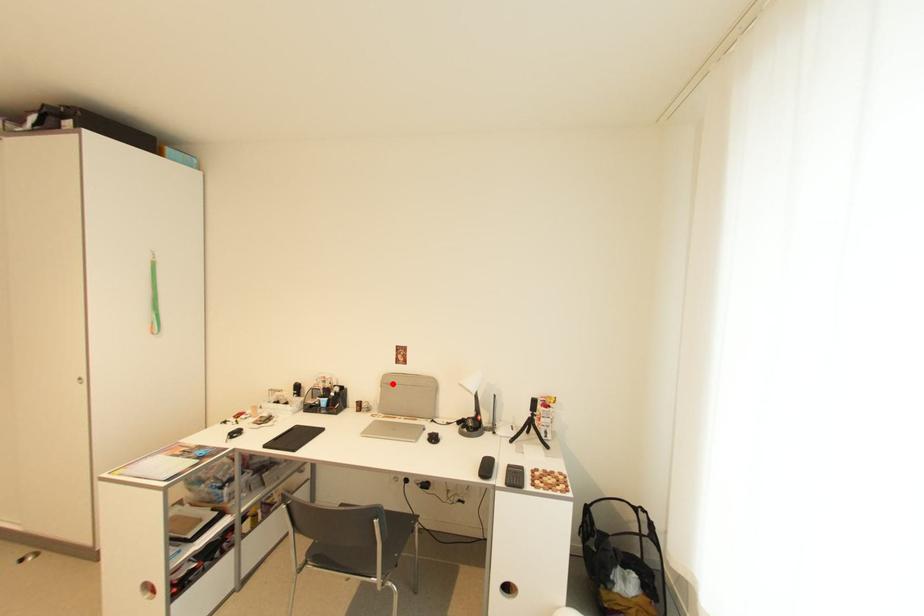
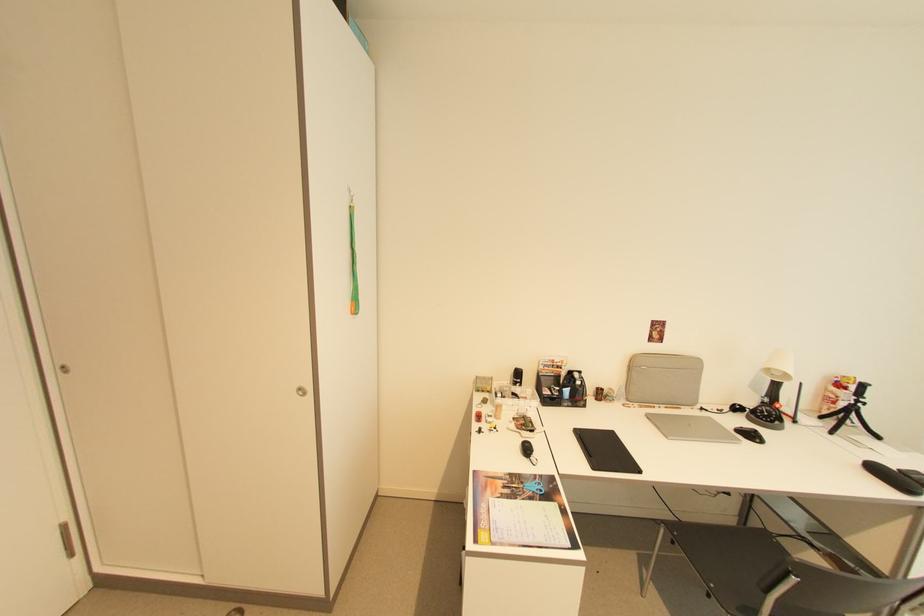
Question: I am providing you with two images of the same scene from different viewpoints. Image1 has a red point marked. In image2, the corresponding 3D location appears at what relative position? Reply with the corresponding letter.

Choices:
 (A) Closer
 (B) Farther

Answer: (A)